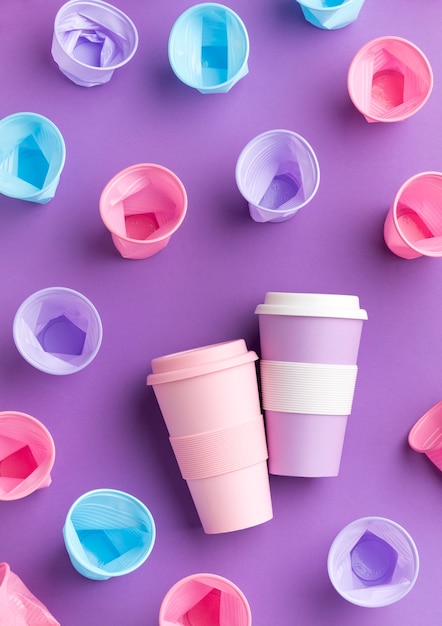
This screenshot has height=626, width=442. Identify the location of light blue cups. (340, 6), (208, 49), (28, 165), (122, 524).